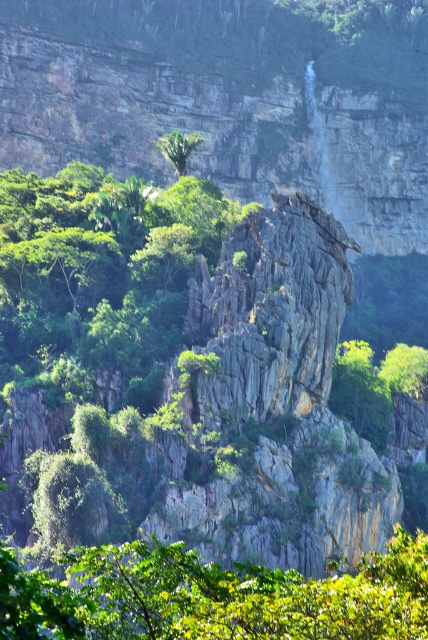
Question: In this image, where is green leafy tree at center located relative to green leafy tree at upper center?

Choices:
 (A) above
 (B) below

Answer: (B)

Question: Is green leafy tree at center bigger than green leafy tree at upper center?

Choices:
 (A) no
 (B) yes

Answer: (B)

Question: Is the position of green leafy tree at center more distant than that of green leafy tree at upper center?

Choices:
 (A) yes
 (B) no

Answer: (B)